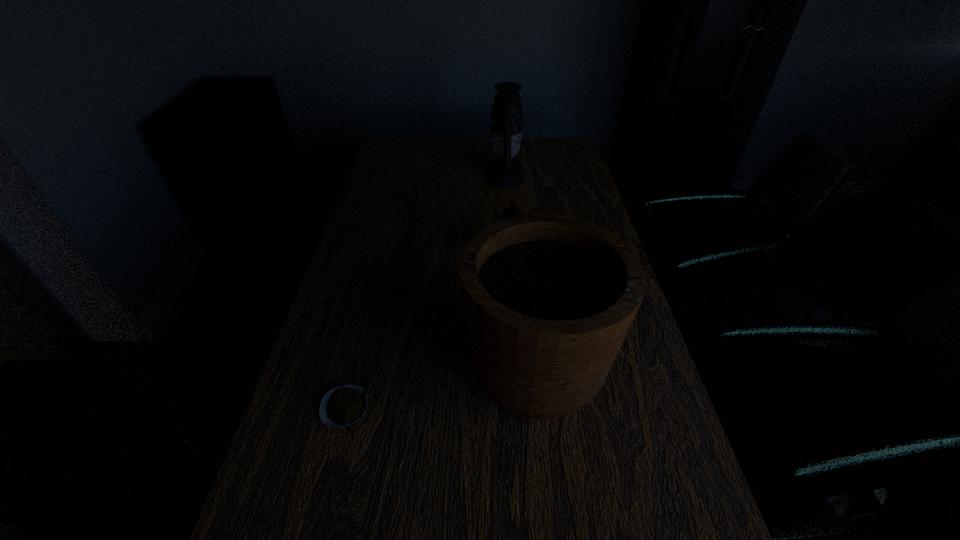
Locate an element on the screen. The height and width of the screenshot is (540, 960). the farthest object is located at coordinates (504, 171).

I want to click on flowerpot, so click(548, 299).

Identify the location of thermos bottle. Image resolution: width=960 pixels, height=540 pixels. tap(512, 211).

Locate an element on the screen. This screenshot has width=960, height=540. the second farthest object is located at coordinates (512, 211).

Locate an element on the screen. The height and width of the screenshot is (540, 960). the shortest object is located at coordinates (344, 405).

I want to click on legume, so click(344, 405).

This screenshot has height=540, width=960. Find the location of `free space located on the right of the oil lamp`. free space located on the right of the oil lamp is located at coordinates click(570, 178).

You are a GUI agent. You are given a task and a screenshot of the screen. Output one action in this format:
    pyautogui.click(x=<x>, y=<y>)
    Task: Click on the free space located 0.320m on the left of the flowerpot
    
    Given the screenshot: What is the action you would take?
    pyautogui.click(x=321, y=367)

Identify the location of vacant space situated 0.230m on the back of the thermos bottle. (505, 206).

You are a GUI agent. You are given a task and a screenshot of the screen. Output one action in this format:
    pyautogui.click(x=<x>, y=<y>)
    Task: Click on the vacant space situated 0.280m on the back of the legume
    
    Given the screenshot: What is the action you would take?
    pyautogui.click(x=373, y=296)